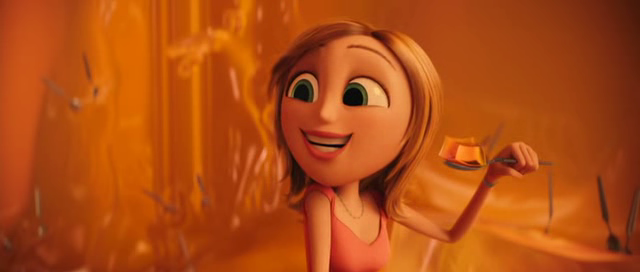
Where is `utensils in background`? The width and height of the screenshot is (640, 272). utensils in background is located at coordinates (552, 208), (614, 244), (628, 223), (164, 198), (182, 243), (201, 185), (91, 76), (61, 97), (41, 201), (493, 133).